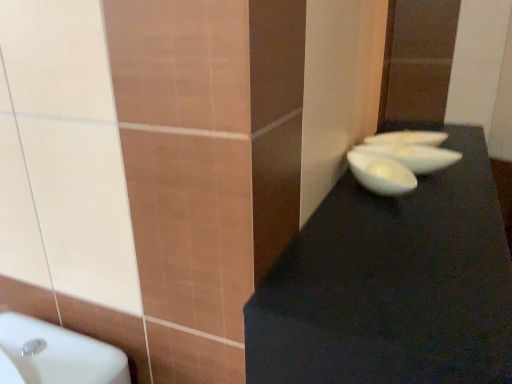
Where is `unoccupied area in front of white glossy bowl at center right`? unoccupied area in front of white glossy bowl at center right is located at coordinates (401, 219).